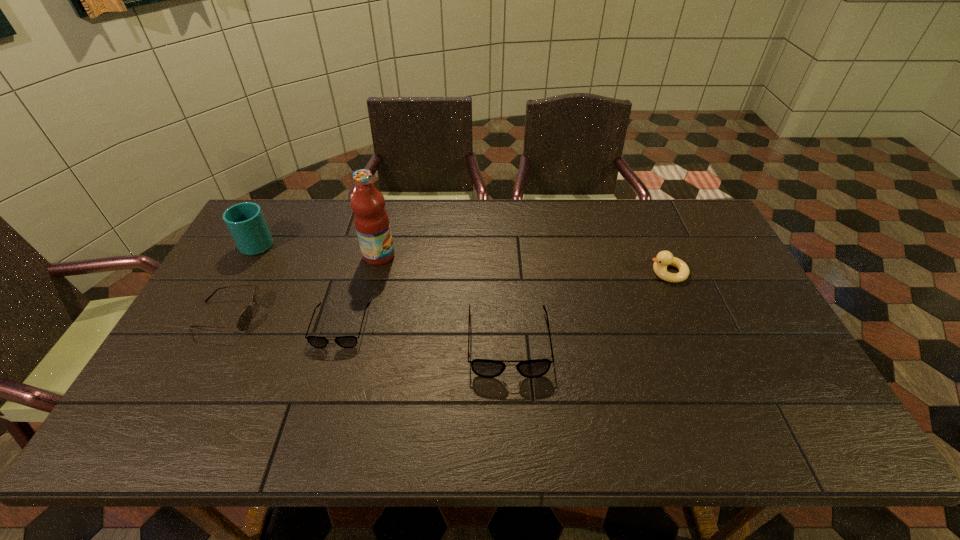
Where is `object positioned at the right edge`? This screenshot has height=540, width=960. object positioned at the right edge is located at coordinates (664, 258).

Locate an element on the screen. The image size is (960, 540). object situated at the far left corner is located at coordinates (245, 221).

Locate an element on the screen. vacant region at the far edge of the desktop is located at coordinates point(440,230).

Where is `vacant space at the near edge of the desktop`? vacant space at the near edge of the desktop is located at coordinates (442, 390).

What are the coordinates of `vacant space at the left edge of the desktop` in the screenshot? It's located at pos(228,326).

At what (x,y) coordinates should I click in order to perform the action: click on blank space at the right edge of the desktop. Please return your answer as a coordinate pair (x, y). This screenshot has height=540, width=960. Looking at the image, I should click on (722, 292).

The image size is (960, 540). I want to click on vacant point at the far right corner, so point(704,221).

The image size is (960, 540). Identify the location of free space that is in between the taller spectacles and the tallest object. [444, 299].

Identify the location of unoccupied area between the right spectacles and the tallest object. Image resolution: width=960 pixels, height=540 pixels. (444, 299).

At what (x,y) coordinates should I click in order to perform the action: click on vacant space in between the second shortest object and the taller spectacles. Please return your answer as a coordinate pair (x, y). Looking at the image, I should click on (369, 328).